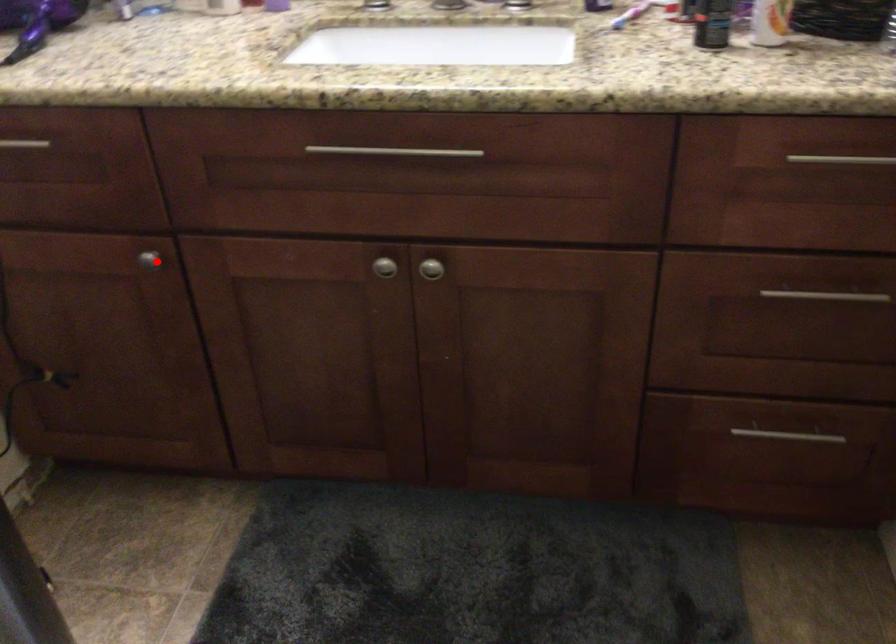
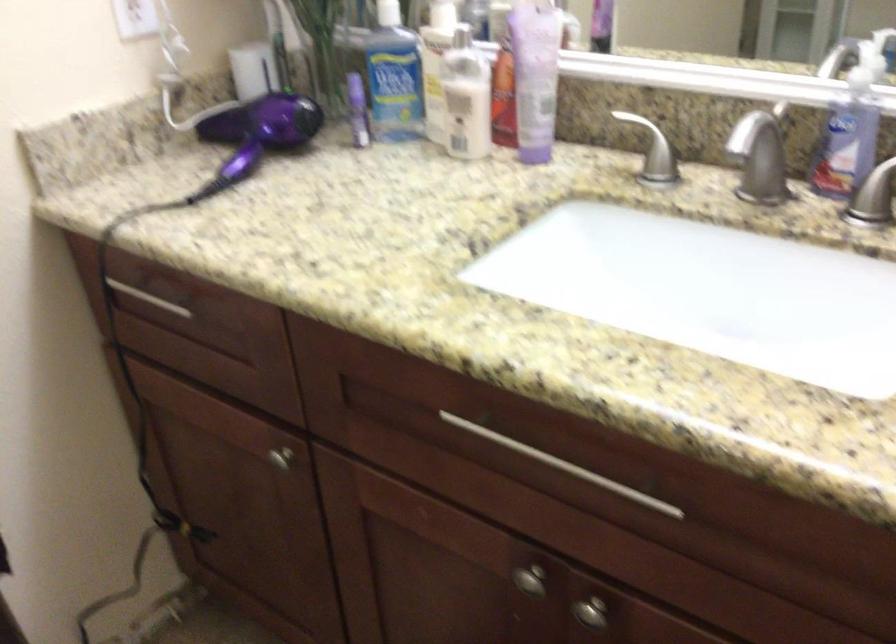
Locate, in the second image, the point that corresponds to the highlighted location in the first image.

(280, 459)